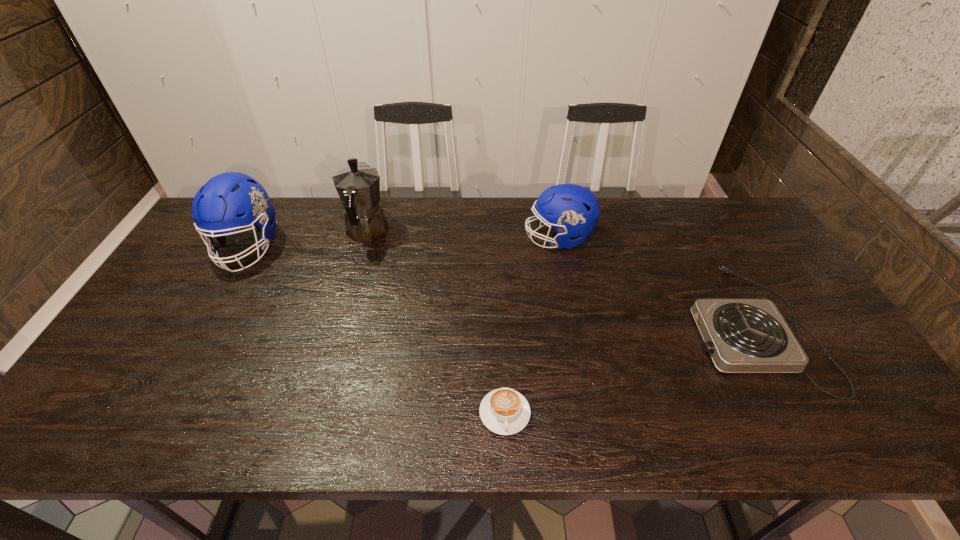
I want to click on the fourth object from right to left, so click(358, 186).

Locate an element on the screen. the left football helmet is located at coordinates (229, 201).

Locate an element on the screen. This screenshot has height=540, width=960. the leftmost object is located at coordinates (229, 201).

At what (x,y) coordinates should I click in order to perform the action: click on the third tallest object. Please return your answer as a coordinate pair (x, y). Image resolution: width=960 pixels, height=540 pixels. Looking at the image, I should click on (573, 210).

You are a GUI agent. You are given a task and a screenshot of the screen. Output one action in this format:
    pyautogui.click(x=<x>, y=<y>)
    Task: Click on the fourth object from left to right
    This screenshot has width=960, height=540.
    Given the screenshot: What is the action you would take?
    pyautogui.click(x=573, y=210)

Where is `the rightmost object`? This screenshot has width=960, height=540. the rightmost object is located at coordinates (741, 335).

Identify the location of the third object from right to left. (504, 411).

The image size is (960, 540). In order to click on free region located on the face guard of the taller football helmet in this screenshot , I will do `click(195, 341)`.

Identify the location of blank space located 0.360m on the front-facing side of the second object from right to left. (414, 238).

You are a GUI agent. You are given a task and a screenshot of the screen. Output one action in this format:
    pyautogui.click(x=<x>, y=<y>)
    Task: Click on the free location located 0.370m on the front-facing side of the second object from right to left
    The height and width of the screenshot is (540, 960).
    Given the screenshot: What is the action you would take?
    pyautogui.click(x=410, y=238)